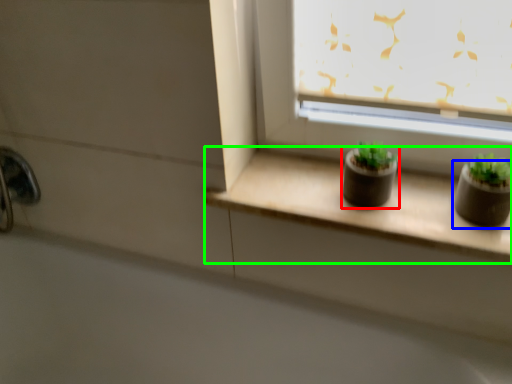
Question: Based on their relative distances, which object is farther from flowerpot (highlighted by a red box)? Choose from flowerpot (highlighted by a blue box) and window sill (highlighted by a green box).

Choices:
 (A) flowerpot
 (B) window sill

Answer: (A)